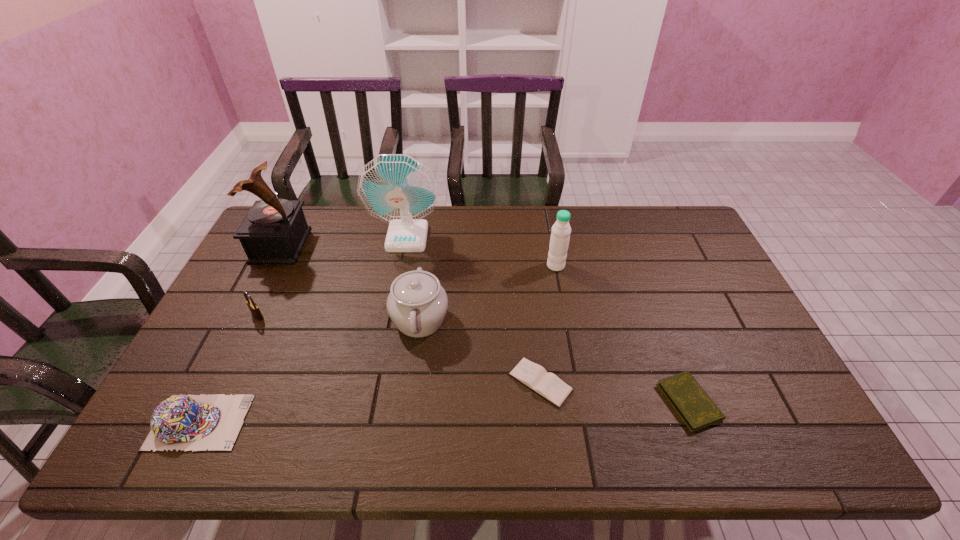
The image size is (960, 540). Identify the location of vacant space located 0.320m on the right of the third tallest object. (663, 266).

Locate an element on the screen. The width and height of the screenshot is (960, 540). vacant region located on the right of the chinaware is located at coordinates (536, 320).

Identify the location of vacant space situated 0.120m on the right of the padlock. This screenshot has width=960, height=540. (306, 316).

The height and width of the screenshot is (540, 960). In order to click on vacant region located on the front, side, and top of the sixth tallest object in this screenshot , I will do `click(363, 422)`.

Image resolution: width=960 pixels, height=540 pixels. I want to click on free space located on the front of the left diary, so click(x=548, y=449).

At what (x,y) coordinates should I click in order to perform the action: click on vacant space situated on the left of the rightmost object. Please return your answer as a coordinate pair (x, y). Looking at the image, I should click on (609, 402).

You are a GUI agent. You are given a task and a screenshot of the screen. Output one action in this format:
    pyautogui.click(x=<x>, y=<y>)
    Task: Click on the fan that is at the far edge
    The width and height of the screenshot is (960, 540).
    Given the screenshot: What is the action you would take?
    pyautogui.click(x=396, y=188)

In order to click on phonograph_record present at the far edge in this screenshot , I will do `click(274, 231)`.

The image size is (960, 540). I want to click on cap that is at the near edge, so click(183, 422).

Find the location of a particular element. This screenshot has width=960, height=540. diary that is at the near edge is located at coordinates (697, 410).